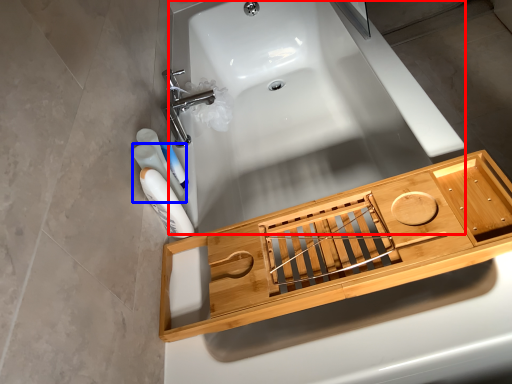
Question: Which object appears closest to the camera in this image, bath (highlighted by a red box) or mouthwash (highlighted by a blue box)?

Choices:
 (A) bath
 (B) mouthwash

Answer: (A)